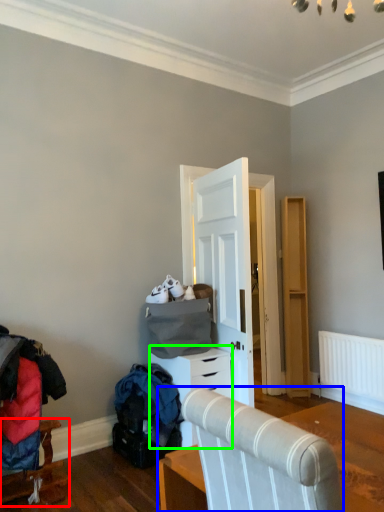
Question: Which is farther away from furniture (highlighted by a red box)? furniture (highlighted by a blue box) or chest of drawers (highlighted by a green box)?

Choices:
 (A) furniture
 (B) chest of drawers

Answer: (A)